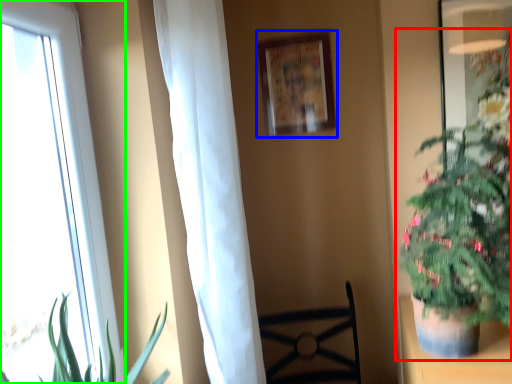
Question: Which object is positioned closest to houseplant (highlighted by a red box)? Select from picture frame (highlighted by a blue box) and window (highlighted by a green box).

Choices:
 (A) picture frame
 (B) window

Answer: (A)